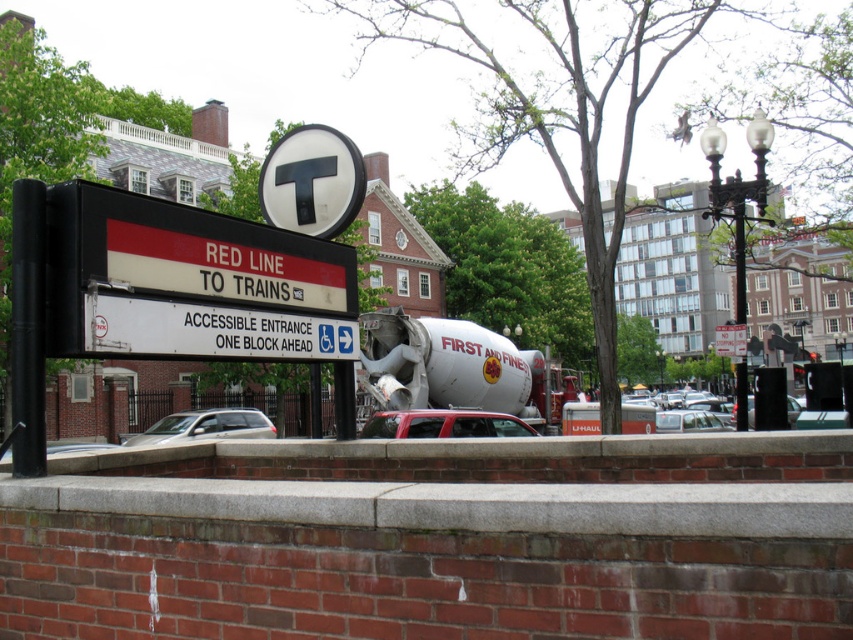
Question: Which object is farther from the camera taking this photo?

Choices:
 (A) satin silver car at center
 (B) metallic silver car at center
 (C) metallic red car at center

Answer: (A)

Question: Can you confirm if metallic silver car at center is positioned below matte silver car at lower left?

Choices:
 (A) no
 (B) yes

Answer: (B)

Question: Does metallic red car at center come behind metallic silver car at center?

Choices:
 (A) yes
 (B) no

Answer: (B)

Question: Considering the real-world distances, which object is closest to the satin silver car at center?

Choices:
 (A) metallic silver car at center
 (B) metallic red car at center

Answer: (B)

Question: Can you confirm if metallic red car at center is positioned above satin silver car at center?

Choices:
 (A) no
 (B) yes

Answer: (B)

Question: Considering the real-world distances, which object is closest to the metallic red car at center?

Choices:
 (A) white plastic sign at upper center
 (B) metallic silver car at center
 (C) satin silver car at center

Answer: (A)